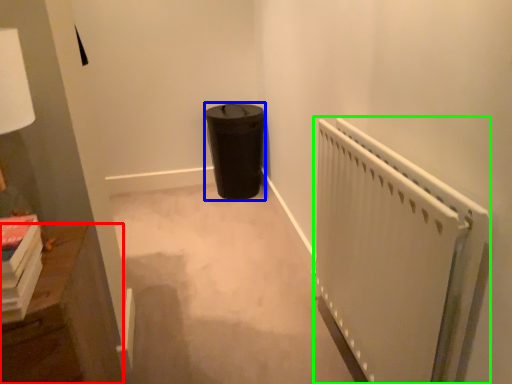
Question: Estimate the real-world distances between objects in this image. Which object is closer to furniture (highlighted by a red box), garbage (highlighted by a blue box) or radiator (highlighted by a green box)?

Choices:
 (A) garbage
 (B) radiator

Answer: (B)